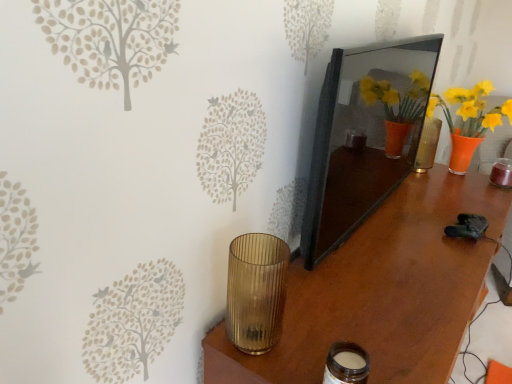
The height and width of the screenshot is (384, 512). In order to click on vacant region to the left of matte glass jar at lower center, acting as the first candle holder starting from the right in this screenshot , I will do `click(267, 355)`.